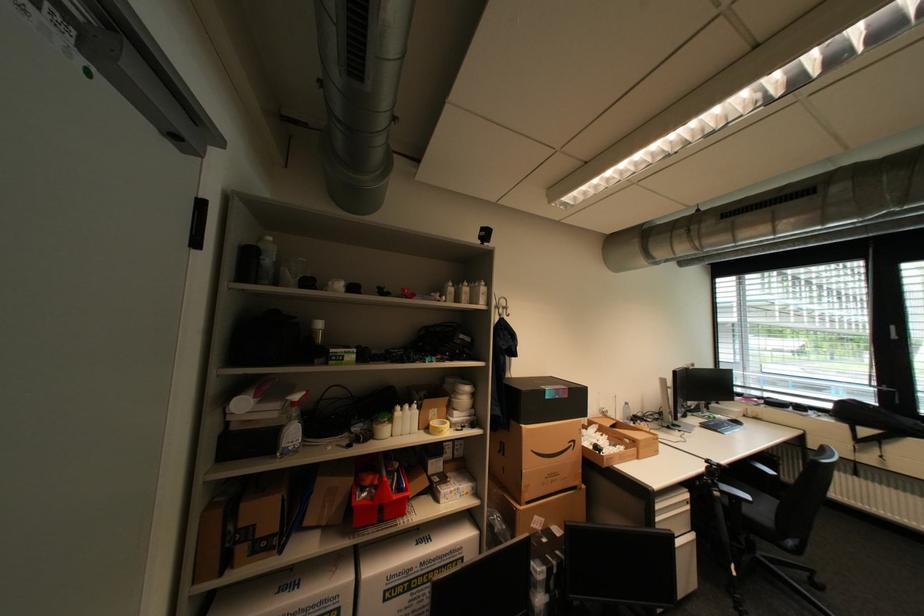
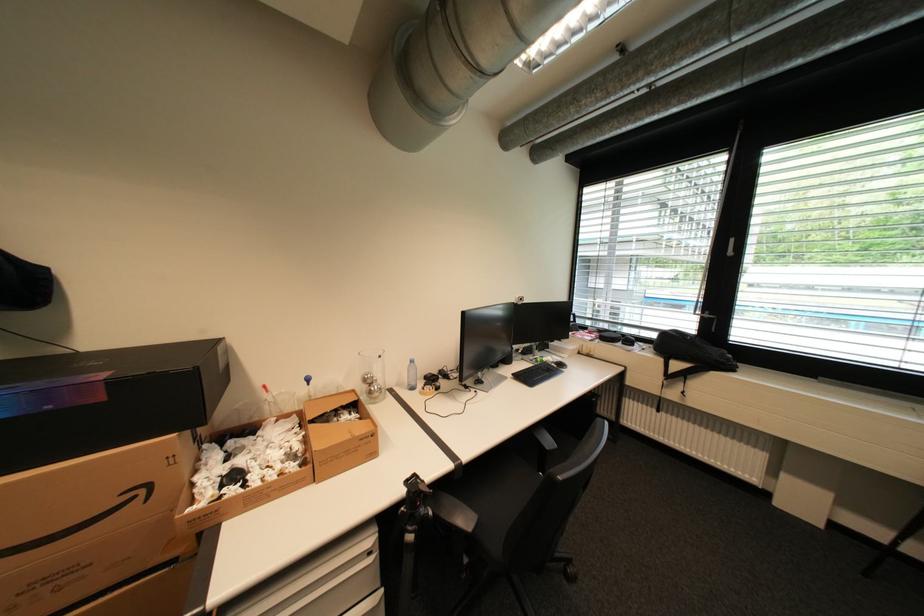
In the second image, find the point that corresponds to the point at 714,463 in the first image.

(416, 484)